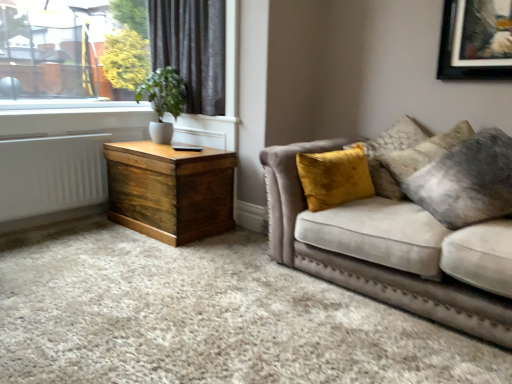
Question: Is velvet yellow pillow at right at the right side of dark grey velvet curtain at upper left?

Choices:
 (A) yes
 (B) no

Answer: (A)

Question: Does velvet yellow pillow at right have a greater width compared to dark grey velvet curtain at upper left?

Choices:
 (A) no
 (B) yes

Answer: (B)

Question: Can you confirm if velvet yellow pillow at right is smaller than dark grey velvet curtain at upper left?

Choices:
 (A) yes
 (B) no

Answer: (A)

Question: Would you consider velvet yellow pillow at right to be distant from dark grey velvet curtain at upper left?

Choices:
 (A) no
 (B) yes

Answer: (B)

Question: Does velvet yellow pillow at right have a lesser height compared to dark grey velvet curtain at upper left?

Choices:
 (A) no
 (B) yes

Answer: (B)

Question: Is velvet yellow pillow at right not within dark grey velvet curtain at upper left?

Choices:
 (A) no
 (B) yes

Answer: (B)

Question: From a real-world perspective, is velvet yellow pillow at right positioned over velvet beige couch at right based on gravity?

Choices:
 (A) no
 (B) yes

Answer: (B)

Question: Is velvet yellow pillow at right next to velvet beige couch at right?

Choices:
 (A) yes
 (B) no

Answer: (B)

Question: Is velvet yellow pillow at right in front of velvet beige couch at right?

Choices:
 (A) no
 (B) yes

Answer: (A)

Question: Can you confirm if velvet yellow pillow at right is wider than velvet beige couch at right?

Choices:
 (A) yes
 (B) no

Answer: (B)

Question: Is velvet yellow pillow at right oriented towards velvet beige couch at right?

Choices:
 (A) yes
 (B) no

Answer: (A)

Question: Is velvet yellow pillow at right not close to velvet beige couch at right?

Choices:
 (A) no
 (B) yes

Answer: (A)

Question: Is wooden trunk at left positioned far away from green matte plant at upper left?

Choices:
 (A) no
 (B) yes

Answer: (A)